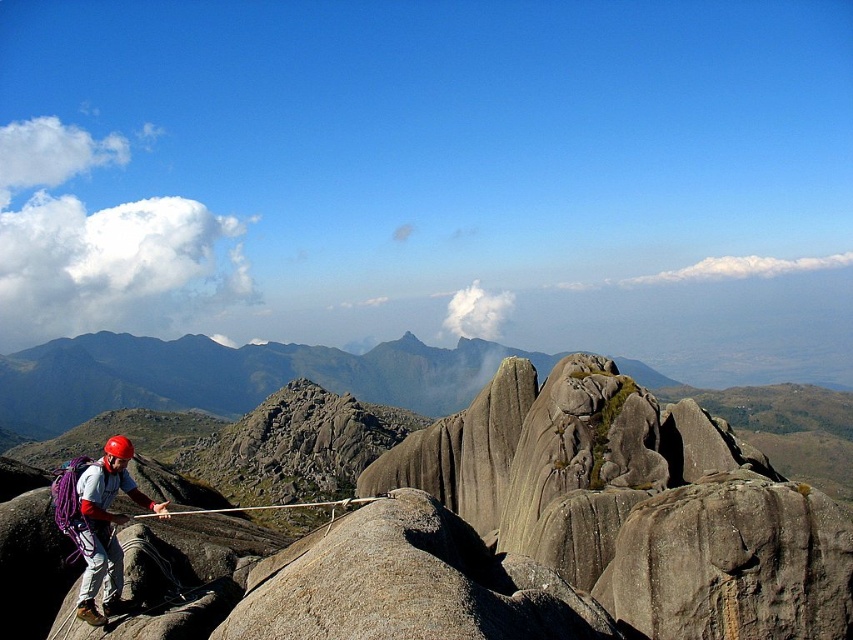
Which of these two, gray rock formation at center or matte gray helmet at left, stands shorter?

matte gray helmet at left is shorter.

Can you confirm if gray rock formation at center is thinner than matte gray helmet at left?

Incorrect, gray rock formation at center's width is not less than matte gray helmet at left's.

Is point (234, 353) positioned behind point (86, 598)?

Yes, point (234, 353) is farther from viewer.

The height and width of the screenshot is (640, 853). I want to click on gray rock formation at center, so click(231, 376).